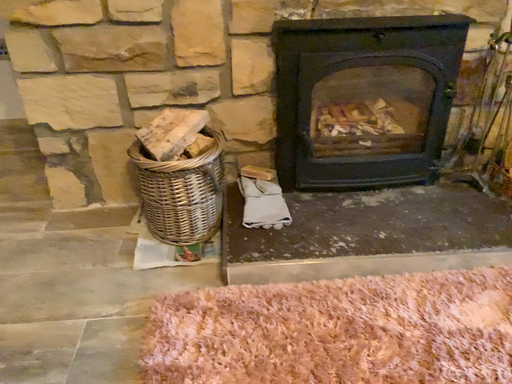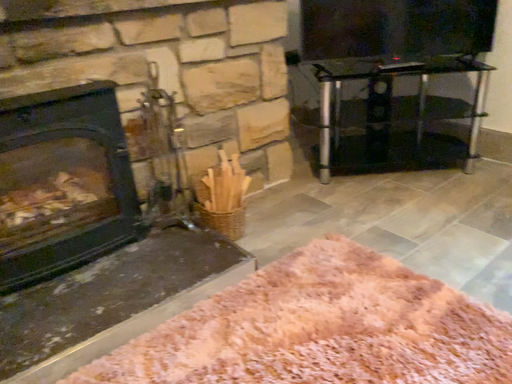
Question: How did the camera likely rotate when shooting the video?

Choices:
 (A) rotated upward
 (B) rotated downward

Answer: (A)